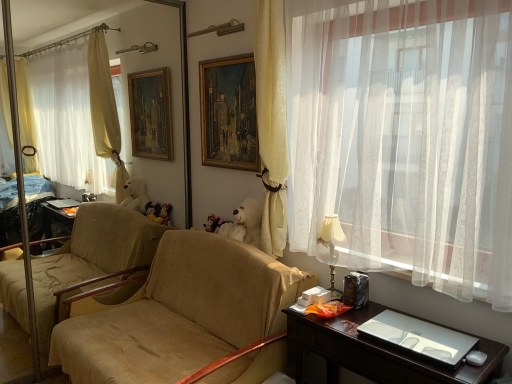
Question: From a real-world perspective, does beige fabric couch at center stand above shiny dark wood desk at lower right?

Choices:
 (A) no
 (B) yes

Answer: (B)

Question: From a real-world perspective, is beige fabric couch at center physically below shiny dark wood desk at lower right?

Choices:
 (A) no
 (B) yes

Answer: (A)

Question: Is beige fabric couch at center positioned beyond the bounds of shiny dark wood desk at lower right?

Choices:
 (A) yes
 (B) no

Answer: (A)

Question: Is beige fabric couch at center to the right of shiny dark wood desk at lower right from the viewer's perspective?

Choices:
 (A) no
 (B) yes

Answer: (A)

Question: Is beige fabric couch at center facing towards shiny dark wood desk at lower right?

Choices:
 (A) yes
 (B) no

Answer: (B)

Question: Is yellow fabric curtain at center, positioned as the first curtain in left-to-right order, inside the boundaries of white plush teddy bear at center, or outside?

Choices:
 (A) inside
 (B) outside

Answer: (B)

Question: Looking at the image, does yellow fabric curtain at center, the 2th curtain from the right, seem bigger or smaller compared to white plush teddy bear at center?

Choices:
 (A) big
 (B) small

Answer: (A)

Question: Is yellow fabric curtain at center, positioned as the first curtain in left-to-right order, in front of or behind white plush teddy bear at center in the image?

Choices:
 (A) behind
 (B) front

Answer: (B)

Question: Is yellow fabric curtain at center, the 2th curtain from the right, wider or thinner than white plush teddy bear at center?

Choices:
 (A) thin
 (B) wide

Answer: (B)

Question: In terms of size, does shiny dark wood desk at lower right appear bigger or smaller than yellow fabric curtain at center, the 2th curtain from the right?

Choices:
 (A) small
 (B) big

Answer: (B)

Question: Is shiny dark wood desk at lower right to the left or to the right of yellow fabric curtain at center, positioned as the first curtain in left-to-right order, in the image?

Choices:
 (A) right
 (B) left

Answer: (A)

Question: From the image's perspective, relative to yellow fabric curtain at center, positioned as the first curtain in left-to-right order, is shiny dark wood desk at lower right above or below?

Choices:
 (A) below
 (B) above

Answer: (A)

Question: Considering the positions of point (393, 360) and point (281, 52), is point (393, 360) closer or farther from the camera than point (281, 52)?

Choices:
 (A) farther
 (B) closer

Answer: (B)

Question: From the image's perspective, is beige fabric couch at center above or below wooden oil painting at center?

Choices:
 (A) below
 (B) above

Answer: (A)

Question: Looking at their shapes, would you say beige fabric couch at center is wider or thinner than wooden oil painting at center?

Choices:
 (A) wide
 (B) thin

Answer: (A)